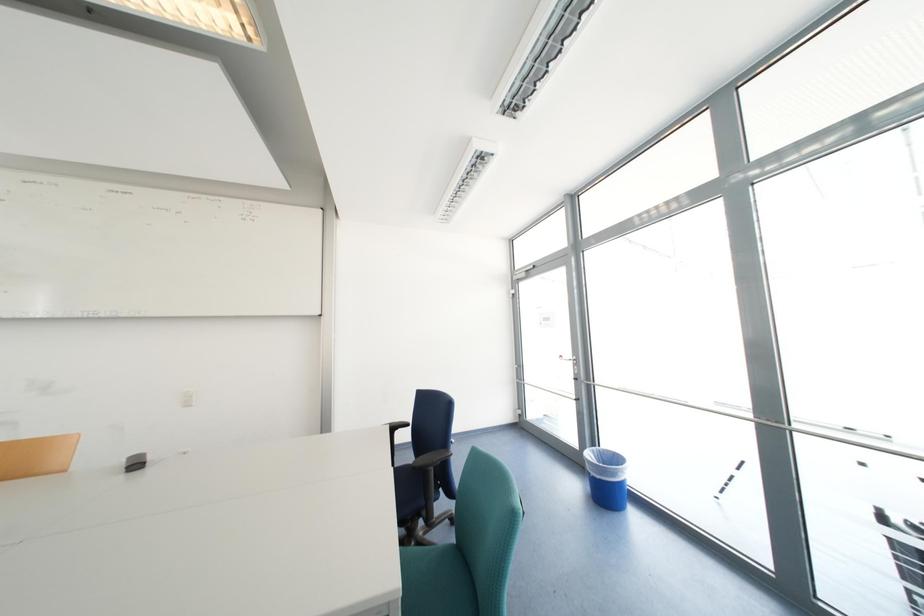
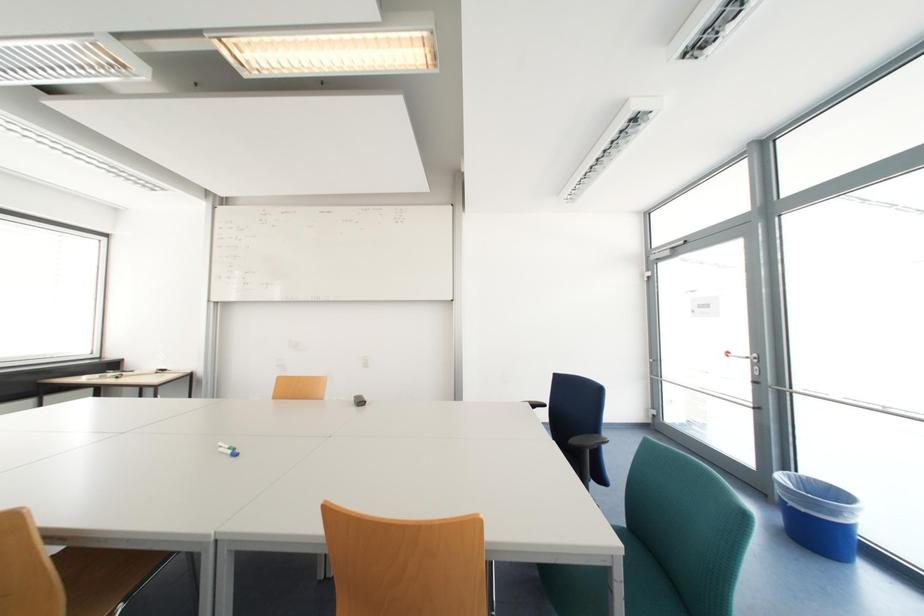
Question: Based on the continuous images, in which direction is the camera rotating? Reply with the corresponding letter.

Choices:
 (A) Left
 (B) Right
 (C) Up
 (D) Down

Answer: (A)